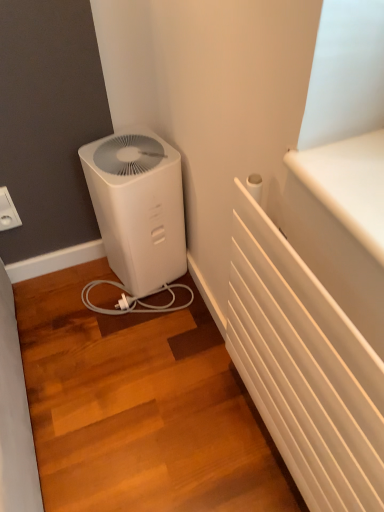
Question: Can you confirm if white plastic electric outlet at upper left is smaller than white plastic air purifier at lower left?

Choices:
 (A) yes
 (B) no

Answer: (A)

Question: Does white plastic electric outlet at upper left have a greater height compared to white plastic air purifier at lower left?

Choices:
 (A) no
 (B) yes

Answer: (A)

Question: Is white plastic electric outlet at upper left oriented towards white plastic air purifier at lower left?

Choices:
 (A) no
 (B) yes

Answer: (A)

Question: Is white plastic electric outlet at upper left to the left of white plastic air purifier at lower left from the viewer's perspective?

Choices:
 (A) no
 (B) yes

Answer: (B)

Question: Can you confirm if white plastic electric outlet at upper left is shorter than white plastic air purifier at lower left?

Choices:
 (A) no
 (B) yes

Answer: (B)

Question: Does white plastic electric outlet at upper left lie in front of white plastic air purifier at lower left?

Choices:
 (A) yes
 (B) no

Answer: (B)

Question: Considering the relative positions of white plastic air purifier at lower left and white plastic electric outlet at upper left in the image provided, is white plastic air purifier at lower left to the left of white plastic electric outlet at upper left from the viewer's perspective?

Choices:
 (A) no
 (B) yes

Answer: (A)

Question: Is white plastic air purifier at lower left surrounding white plastic electric outlet at upper left?

Choices:
 (A) yes
 (B) no

Answer: (B)

Question: Is white plastic air purifier at lower left positioned with its back to white plastic electric outlet at upper left?

Choices:
 (A) no
 (B) yes

Answer: (A)

Question: Considering the relative positions of white plastic air purifier at lower left and white plastic electric outlet at upper left in the image provided, is white plastic air purifier at lower left in front of white plastic electric outlet at upper left?

Choices:
 (A) yes
 (B) no

Answer: (A)

Question: From the image's perspective, is white plastic air purifier at lower left located beneath white plastic electric outlet at upper left?

Choices:
 (A) yes
 (B) no

Answer: (A)

Question: Can you confirm if white plastic air purifier at lower left is wider than white plastic electric outlet at upper left?

Choices:
 (A) no
 (B) yes

Answer: (B)

Question: Considering the positions of white plastic air purifier at lower left and white plastic electric outlet at upper left in the image, is white plastic air purifier at lower left bigger or smaller than white plastic electric outlet at upper left?

Choices:
 (A) big
 (B) small

Answer: (A)